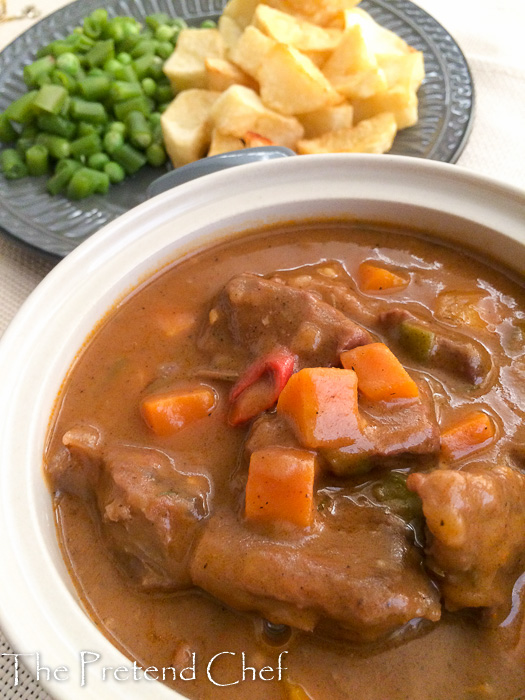
Find the location of `grey plate`. grey plate is located at coordinates (37, 214).